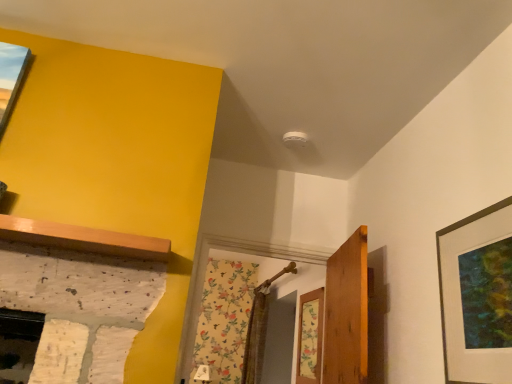
Question: From a real-world perspective, is wooden door at center under matte black picture frame at right?

Choices:
 (A) yes
 (B) no

Answer: (A)

Question: From the image's perspective, does wooden door at center appear lower than matte black picture frame at right?

Choices:
 (A) yes
 (B) no

Answer: (A)

Question: Does wooden door at center have a lesser height compared to matte black picture frame at right?

Choices:
 (A) no
 (B) yes

Answer: (A)

Question: Is wooden door at center positioned behind matte black picture frame at right?

Choices:
 (A) no
 (B) yes

Answer: (B)

Question: Considering the relative sizes of wooden door at center and matte black picture frame at right in the image provided, is wooden door at center smaller than matte black picture frame at right?

Choices:
 (A) yes
 (B) no

Answer: (B)

Question: Is wooden door at center facing away from matte black picture frame at right?

Choices:
 (A) no
 (B) yes

Answer: (A)

Question: From a real-world perspective, is floral wallpaper at center on matte black picture frame at right?

Choices:
 (A) no
 (B) yes

Answer: (A)

Question: Considering the relative positions of floral wallpaper at center and matte black picture frame at right in the image provided, is floral wallpaper at center in front of matte black picture frame at right?

Choices:
 (A) yes
 (B) no

Answer: (B)

Question: From the image's perspective, is floral wallpaper at center above matte black picture frame at right?

Choices:
 (A) no
 (B) yes

Answer: (A)

Question: Considering the relative sizes of floral wallpaper at center and matte black picture frame at right in the image provided, is floral wallpaper at center smaller than matte black picture frame at right?

Choices:
 (A) yes
 (B) no

Answer: (B)

Question: Is floral wallpaper at center thinner than matte black picture frame at right?

Choices:
 (A) yes
 (B) no

Answer: (B)

Question: Could you tell me if floral wallpaper at center is turned towards matte black picture frame at right?

Choices:
 (A) yes
 (B) no

Answer: (B)

Question: From the image's perspective, is matte black picture frame at right located beneath wooden door at center?

Choices:
 (A) yes
 (B) no

Answer: (B)